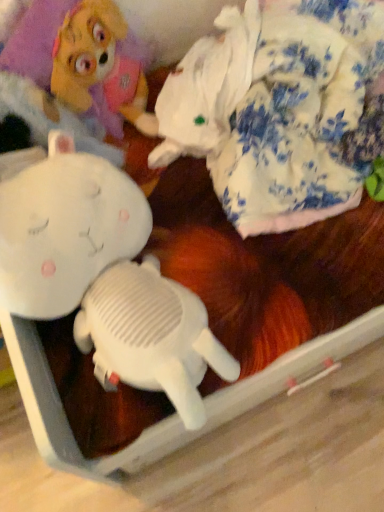
The width and height of the screenshot is (384, 512). Describe the element at coordinates (280, 110) in the screenshot. I see `fluffy white blanket at upper right, which appears as the first toy when viewed from the right` at that location.

What is the approximate height of white matte toy at center, marked as the second toy in a right-to-left arrangement?

13.86 centimeters.

You are a GUI agent. You are given a task and a screenshot of the screen. Output one action in this format:
    pyautogui.click(x=<x>, y=<y>)
    Task: Click on the white plush toy at center, marked as the first toy in a left-to-right arrangement
    The width and height of the screenshot is (384, 512).
    Given the screenshot: What is the action you would take?
    pyautogui.click(x=104, y=277)

Where is `white plush toy at upper left`? This screenshot has height=512, width=384. white plush toy at upper left is located at coordinates (49, 117).

What is the approximate height of white plush rabbit at upper left, placed as the 3th toy when sorted from right to left?

18.14 inches.

Locate an element on the screen. This screenshot has height=512, width=384. fluffy white blanket at upper right, which is counted as the fourth toy, starting from the left is located at coordinates (280, 110).

Which object is positioned more to the left, white plush rabbit at upper left, placed as the 3th toy when sorted from right to left, or white matte toy at center, marked as the third toy in a left-to-right arrangement?

Positioned to the left is white plush rabbit at upper left, placed as the 3th toy when sorted from right to left.

From the image's perspective, between white plush rabbit at upper left, positioned as the 2th toy in left-to-right order, and white matte toy at center, marked as the second toy in a right-to-left arrangement, which one is located above?

white plush rabbit at upper left, positioned as the 2th toy in left-to-right order, is shown above in the image.

How different are the orientations of white plush rabbit at upper left, placed as the 3th toy when sorted from right to left, and white matte toy at center, marked as the second toy in a right-to-left arrangement, in degrees?

The facing directions of white plush rabbit at upper left, placed as the 3th toy when sorted from right to left, and white matte toy at center, marked as the second toy in a right-to-left arrangement, are 35.8 degrees apart.

Is fluffy white blanket at upper right, which appears as the first toy when viewed from the right, beside white plush rabbit at upper left, positioned as the 2th toy in left-to-right order?

fluffy white blanket at upper right, which appears as the first toy when viewed from the right, and white plush rabbit at upper left, positioned as the 2th toy in left-to-right order, are not in contact.

Between fluffy white blanket at upper right, which appears as the first toy when viewed from the right, and white plush rabbit at upper left, placed as the 3th toy when sorted from right to left, which one has smaller width?

white plush rabbit at upper left, placed as the 3th toy when sorted from right to left, is thinner.

Where is `toy above the fluffy white blanket at upper right, which appears as the first toy when viewed from the right (from the image's perspective)`? toy above the fluffy white blanket at upper right, which appears as the first toy when viewed from the right (from the image's perspective) is located at coordinates [77, 73].

Does fluffy white blanket at upper right, which is counted as the fourth toy, starting from the left, have a smaller size compared to white plush rabbit at upper left, placed as the 3th toy when sorted from right to left?

Actually, fluffy white blanket at upper right, which is counted as the fourth toy, starting from the left, might be larger than white plush rabbit at upper left, placed as the 3th toy when sorted from right to left.

How different are the orientations of white plush toy at upper left and fluffy white blanket at upper right, which appears as the first toy when viewed from the right, in degrees?

There is a 69.4-degree angle between the facing directions of white plush toy at upper left and fluffy white blanket at upper right, which appears as the first toy when viewed from the right.

Is white plush toy at upper left not close to fluffy white blanket at upper right, which appears as the first toy when viewed from the right?

That's not correct — white plush toy at upper left is a little close to fluffy white blanket at upper right, which appears as the first toy when viewed from the right.

Is white plush toy at upper left outside of fluffy white blanket at upper right, which appears as the first toy when viewed from the right?

Yes.

From the image's perspective, is white plush toy at upper left on top of fluffy white blanket at upper right, which appears as the first toy when viewed from the right?

No, from the image's perspective, white plush toy at upper left is not on top of fluffy white blanket at upper right, which appears as the first toy when viewed from the right.

From a real-world perspective, is white plush toy at center, marked as the first toy in a left-to-right arrangement, over white matte toy at center, marked as the third toy in a left-to-right arrangement?

Yes, from a real-world perspective, white plush toy at center, marked as the first toy in a left-to-right arrangement, is over white matte toy at center, marked as the third toy in a left-to-right arrangement

From the image's perspective, is white plush toy at center, marked as the first toy in a left-to-right arrangement, below white matte toy at center, marked as the second toy in a right-to-left arrangement?

Actually, white plush toy at center, marked as the first toy in a left-to-right arrangement, appears above white matte toy at center, marked as the second toy in a right-to-left arrangement, in the image.

Is white plush toy at center, marked as the first toy in a left-to-right arrangement, completely or partially outside of white matte toy at center, marked as the third toy in a left-to-right arrangement?

Yes.

Looking at the image, does white plush toy at center, positioned as the 4th toy in right-to-left order, seem bigger or smaller compared to white matte toy at center, marked as the third toy in a left-to-right arrangement?

Considering their sizes, white plush toy at center, positioned as the 4th toy in right-to-left order, takes up more space than white matte toy at center, marked as the third toy in a left-to-right arrangement.

In terms of height, does fluffy white blanket at upper right, which is counted as the fourth toy, starting from the left, look taller or shorter compared to white matte toy at center, marked as the third toy in a left-to-right arrangement?

fluffy white blanket at upper right, which is counted as the fourth toy, starting from the left, is taller than white matte toy at center, marked as the third toy in a left-to-right arrangement.

Considering the sizes of objects fluffy white blanket at upper right, which appears as the first toy when viewed from the right, and white matte toy at center, marked as the third toy in a left-to-right arrangement, in the image provided, who is smaller, fluffy white blanket at upper right, which appears as the first toy when viewed from the right, or white matte toy at center, marked as the third toy in a left-to-right arrangement,?

Answer: Smaller between the two is white matte toy at center, marked as the third toy in a left-to-right arrangement.

Choose the correct answer: Is fluffy white blanket at upper right, which appears as the first toy when viewed from the right, inside white matte toy at center, marked as the second toy in a right-to-left arrangement, or outside it?

fluffy white blanket at upper right, which appears as the first toy when viewed from the right, lies outside white matte toy at center, marked as the second toy in a right-to-left arrangement.

From a real-world perspective, which is physically below, fluffy white blanket at upper right, which is counted as the fourth toy, starting from the left, or white matte toy at center, marked as the third toy in a left-to-right arrangement?

From a 3D spatial view, white matte toy at center, marked as the third toy in a left-to-right arrangement, is below.

Is white matte toy at center, marked as the second toy in a right-to-left arrangement, oriented away from white plush toy at center, marked as the first toy in a left-to-right arrangement?

Yes, white matte toy at center, marked as the second toy in a right-to-left arrangement,'s orientation is away from white plush toy at center, marked as the first toy in a left-to-right arrangement.

Find the location of a particular element. The image size is (384, 512). toy below the white plush toy at center, marked as the first toy in a left-to-right arrangement (from the image's perspective) is located at coordinates (151, 336).

Is white plush toy at center, marked as the first toy in a left-to-right arrangement, located within white matte toy at center, marked as the second toy in a right-to-left arrangement?

No.

Is white matte toy at center, marked as the third toy in a left-to-right arrangement, to the left of white plush toy at center, marked as the first toy in a left-to-right arrangement, from the viewer's perspective?

In fact, white matte toy at center, marked as the third toy in a left-to-right arrangement, is to the right of white plush toy at center, marked as the first toy in a left-to-right arrangement.

Is white matte toy at center, marked as the third toy in a left-to-right arrangement, beside white plush toy at upper left?

They are not placed beside each other.

Which of these two, white matte toy at center, marked as the third toy in a left-to-right arrangement, or white plush toy at upper left, stands shorter?

With less height is white matte toy at center, marked as the third toy in a left-to-right arrangement.

Is white matte toy at center, marked as the third toy in a left-to-right arrangement, oriented towards white plush toy at upper left?

No, white matte toy at center, marked as the third toy in a left-to-right arrangement, does not turn towards white plush toy at upper left.

Which of these two, white matte toy at center, marked as the third toy in a left-to-right arrangement, or white plush toy at upper left, is wider?

Wider between the two is white matte toy at center, marked as the third toy in a left-to-right arrangement.

From a real-world perspective, which toy is the 3rd one underneath the white plush rabbit at upper left, placed as the 3th toy when sorted from right to left? Please provide its 2D coordinates.

[(151, 336)]

In the image, there is a fluffy white blanket at upper right, which appears as the first toy when viewed from the right. Where is `toy above it (from the image's perspective)`? This screenshot has width=384, height=512. toy above it (from the image's perspective) is located at coordinates pyautogui.click(x=77, y=73).

From the image, which object appears to be farther from fluffy white blanket at upper right, which appears as the first toy when viewed from the right, white plush toy at center, marked as the first toy in a left-to-right arrangement, or white plush toy at upper left?

white plush toy at upper left.

Which object lies nearer to the anchor point white plush toy at center, marked as the first toy in a left-to-right arrangement, white plush toy at upper left or white plush rabbit at upper left, positioned as the 2th toy in left-to-right order?

Based on the image, white plush toy at upper left appears to be nearer to white plush toy at center, marked as the first toy in a left-to-right arrangement.

Considering their positions, is white plush rabbit at upper left, placed as the 3th toy when sorted from right to left, positioned closer to white plush toy at upper left than fluffy white blanket at upper right, which appears as the first toy when viewed from the right?

white plush rabbit at upper left, placed as the 3th toy when sorted from right to left, is positioned closer to the anchor white plush toy at upper left.

Which object lies nearer to the anchor point white plush rabbit at upper left, placed as the 3th toy when sorted from right to left, white plush toy at upper left or white plush toy at center, marked as the first toy in a left-to-right arrangement?

white plush toy at upper left.

Which object lies nearer to the anchor point fluffy white blanket at upper right, which appears as the first toy when viewed from the right, white plush rabbit at upper left, placed as the 3th toy when sorted from right to left, or white plush toy at upper left?

The object closer to fluffy white blanket at upper right, which appears as the first toy when viewed from the right, is white plush rabbit at upper left, placed as the 3th toy when sorted from right to left.

From the image, which object appears to be nearer to white plush rabbit at upper left, placed as the 3th toy when sorted from right to left, white plush toy at upper left or fluffy white blanket at upper right, which is counted as the fourth toy, starting from the left?

white plush toy at upper left.

When comparing their distances from fluffy white blanket at upper right, which is counted as the fourth toy, starting from the left, does white matte toy at center, marked as the second toy in a right-to-left arrangement, or white plush toy at center, marked as the first toy in a left-to-right arrangement, seem closer?

The object closer to fluffy white blanket at upper right, which is counted as the fourth toy, starting from the left, is white plush toy at center, marked as the first toy in a left-to-right arrangement.

Based on their spatial positions, is white plush rabbit at upper left, positioned as the 2th toy in left-to-right order, or white matte toy at center, marked as the third toy in a left-to-right arrangement, closer to white plush toy at center, positioned as the 4th toy in right-to-left order?

The object closer to white plush toy at center, positioned as the 4th toy in right-to-left order, is white matte toy at center, marked as the third toy in a left-to-right arrangement.

Where is `clothing that lies between white plush rabbit at upper left, positioned as the 2th toy in left-to-right order, and white matte toy at center, marked as the third toy in a left-to-right arrangement, from top to bottom`? Image resolution: width=384 pixels, height=512 pixels. clothing that lies between white plush rabbit at upper left, positioned as the 2th toy in left-to-right order, and white matte toy at center, marked as the third toy in a left-to-right arrangement, from top to bottom is located at coordinates (49, 117).

Image resolution: width=384 pixels, height=512 pixels. I want to click on clothing between white plush rabbit at upper left, placed as the 3th toy when sorted from right to left, and white plush toy at center, positioned as the 4th toy in right-to-left order, in the up-down direction, so click(49, 117).

Locate an element on the screen. toy between white plush toy at upper left and white matte toy at center, marked as the second toy in a right-to-left arrangement, vertically is located at coordinates (104, 277).

Find the location of a particular element. toy between fluffy white blanket at upper right, which is counted as the fourth toy, starting from the left, and white matte toy at center, marked as the second toy in a right-to-left arrangement, vertically is located at coordinates (104, 277).